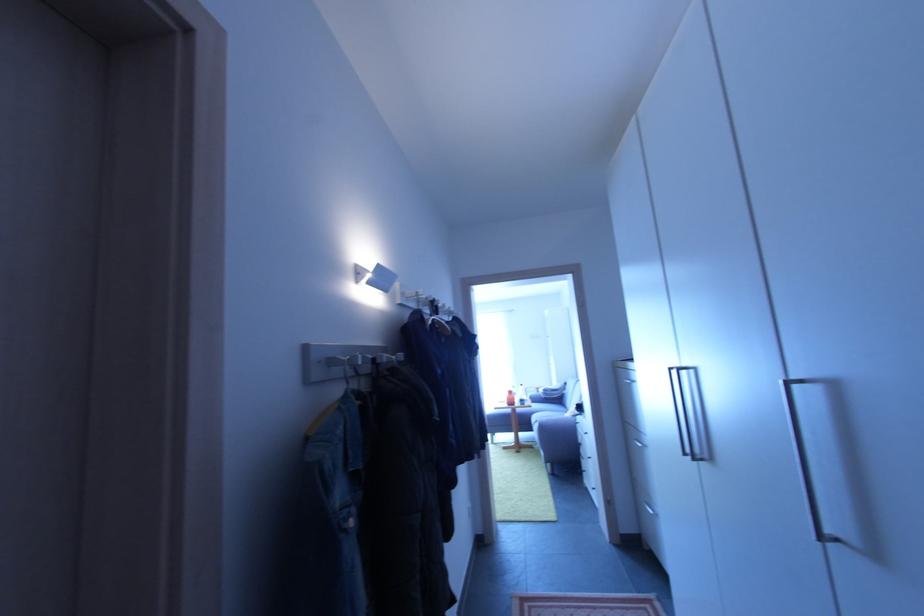
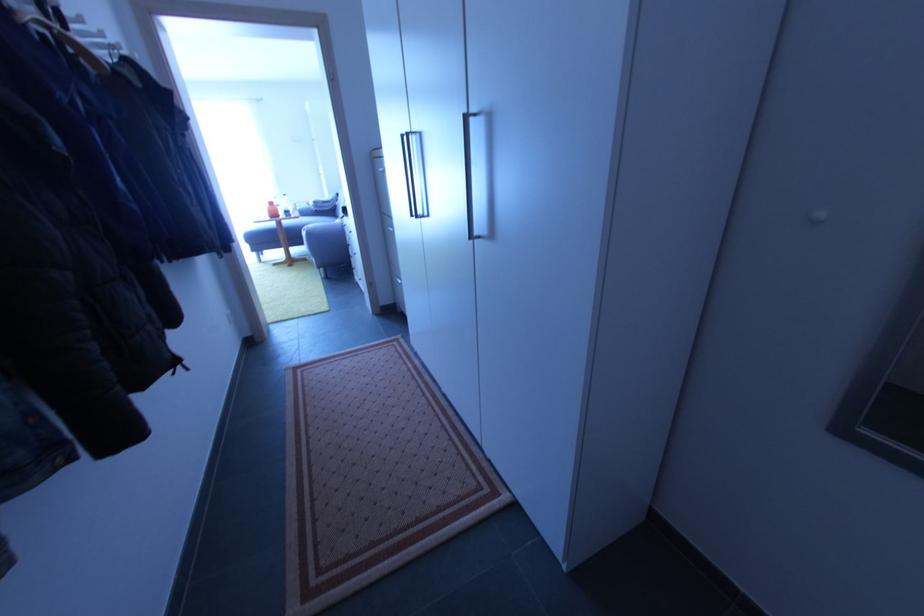
Find the pixel in the second image that matches (x=800, y=387) in the first image.

(476, 122)